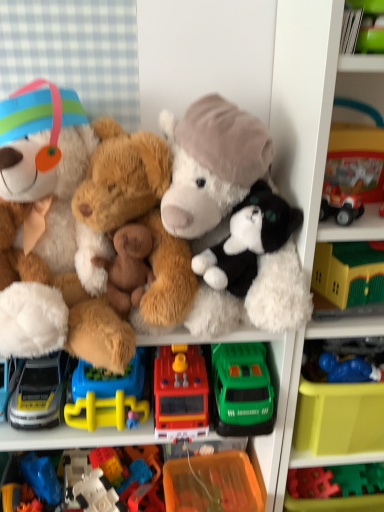
Question: Relative to matte blue car at lower left, which is counted as the sixth toy, starting from the right, is fluffy brown teddy bear at center, arranged as the second teddy bear when viewed from the right, in front or behind?

Choices:
 (A) front
 (B) behind

Answer: (A)

Question: From the image's perspective, is fluffy brown teddy bear at center, arranged as the second teddy bear when viewed from the right, positioned above or below matte blue car at lower left, which is counted as the sixth toy, starting from the right?

Choices:
 (A) below
 (B) above

Answer: (B)

Question: Which object is positioned farthest from the fluffy white teddy bear at left, acting as the first teddy bear starting from the left?

Choices:
 (A) matte blue car at lower left, positioned as the first toy in left-to-right order
 (B) fluffy white teddy bear at center, which is the 1th teddy bear from right to left
 (C) translucent plastic building blocks at center, which is the fifth toy from right to left
 (D) blue rubber toy at lower right, marked as the 6th toy in a left-to-right arrangement
 (E) rubber fire truck at center, the fourth toy viewed from the left

Answer: (D)

Question: Estimate the real-world distances between objects in this image. Which object is farther from the translucent plastic building blocks at center, which is the second toy from left to right?

Choices:
 (A) blue rubber toy at lower right, marked as the 6th toy in a left-to-right arrangement
 (B) white plastic shelf at upper right
 (C) rubber fire truck at center, which ranks as the third toy in right-to-left order
 (D) green plastic car at center, the 2th toy when ordered from right to left
 (E) orange plastic container at lower center

Answer: (A)